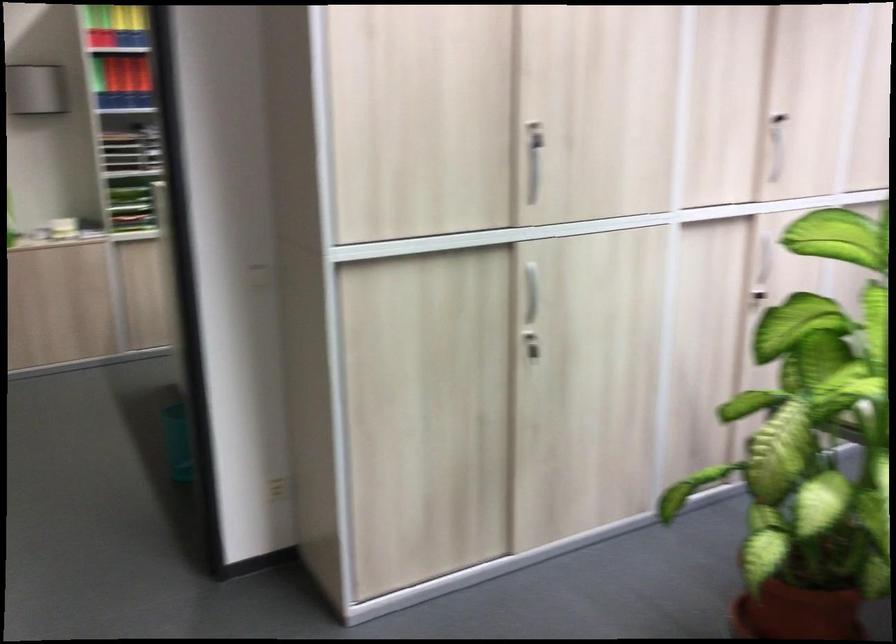
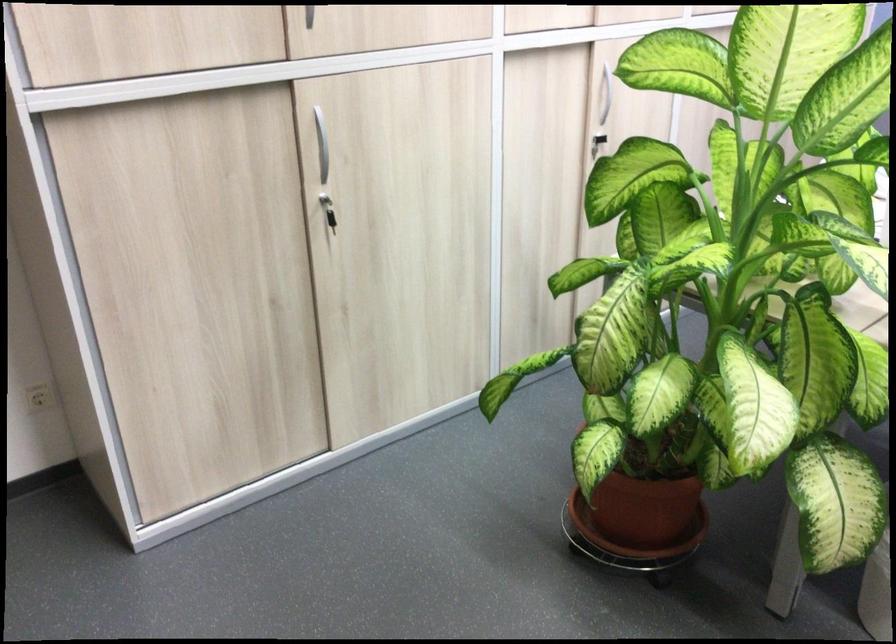
The point at (531,286) is marked in the first image. Where is the corresponding point in the second image?

(321, 140)